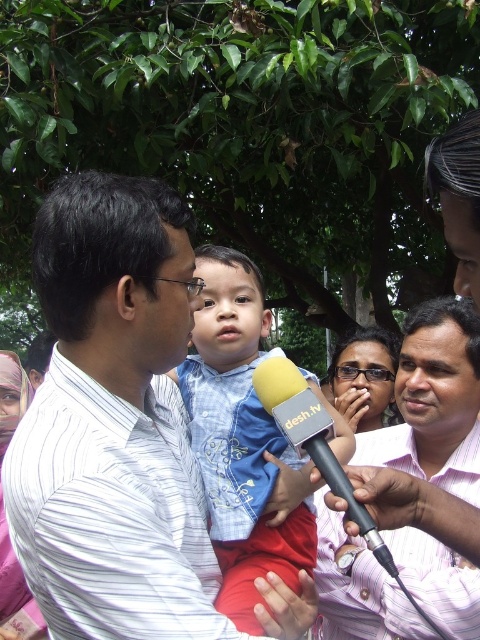
You are a photographer at the scene and need to adjust your camera focus. Since the pink striped shirt at center and the matte black glasses at center are both in the frame, which object should you focus on to ensure it appears clearer in the photo?

The pink striped shirt at center is larger in size than matte black glasses at center, so focusing on the pink striped shirt at center would ensure it appears clearer in the photo.

You are a photographer trying to capture a closeup of the pink striped shirt at center. The camera you are using has a focal length of 50mm. Based on the coordinates provided, can you determine if the shirt is positioned within the recommended focus area for a portrait shot? The recommended focus area for portraits is between 0.5 and 0.8 on the x and y axes.

The pink striped shirt at center is positioned at coordinates point (433,401). Since the recommended focus area for portraits is between 0.5 and 0.8 on both axes, the y coordinate of 0.904 exceeds the upper limit. Therefore, the shirt is slightly outside the recommended focus area for a portrait shot.

You are a photographer adjusting your camera settings to focus on the matte black glasses at center. However, you notice the yellow foam microphone at center is blocking your view. Can you determine if the microphone is in front of or behind the glasses from your current position?

The yellow foam microphone at center is closer to the viewer than matte black glasses at center, so the microphone is in front of the glasses and blocking the view.